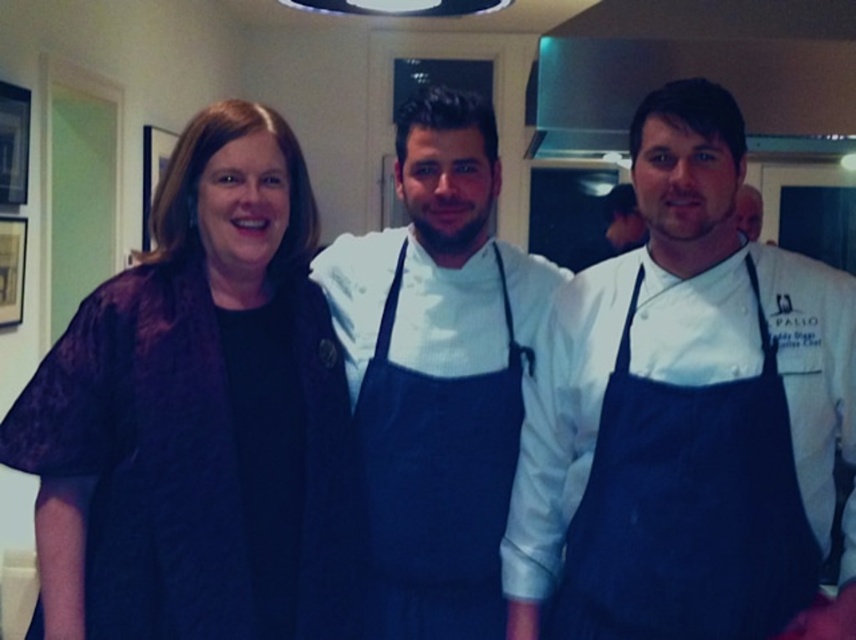
Is dark blue fabric apron at right behind stainless steel exhaust hood at upper center?

No, dark blue fabric apron at right is closer to the viewer.

Which is below, dark blue fabric apron at right or stainless steel exhaust hood at upper center?

dark blue fabric apron at right is lower down.

Is point (635, 388) positioned before point (553, 124)?

Yes, point (635, 388) is closer to viewer.

Find the location of a particular element. The height and width of the screenshot is (640, 856). dark blue fabric apron at right is located at coordinates (688, 508).

Between point (377, 561) and point (373, 580), which one is positioned behind?

Point (373, 580)

Who is more forward, (360, 276) or (431, 548)?

Positioned in front is point (431, 548).

Is point (535, 316) farther from camera compared to point (455, 628)?

Yes, it is.

This screenshot has height=640, width=856. In order to click on blue fabric apron at center in this screenshot , I will do `click(437, 372)`.

Is blue fabric apron at center to the right of stainless steel exhaust hood at upper center from the viewer's perspective?

In fact, blue fabric apron at center is to the left of stainless steel exhaust hood at upper center.

What are the coordinates of `blue fabric apron at center` in the screenshot? It's located at (437, 372).